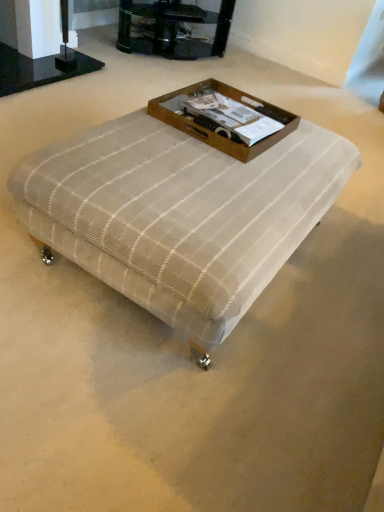
What do you see at coordinates (224, 118) in the screenshot? I see `brown wooden tray at center` at bounding box center [224, 118].

Describe the element at coordinates (180, 214) in the screenshot. I see `plaid fabric ottoman at center` at that location.

Where is `brown wooden tray at center`? The width and height of the screenshot is (384, 512). brown wooden tray at center is located at coordinates (224, 118).

From a real-world perspective, which object rests below the other?

plaid fabric ottoman at center, from a real-world perspective.

Could you tell me if plaid fabric ottoman at center is facing brown wooden tray at center?

No.

Is plaid fabric ottoman at center taller or shorter than brown wooden tray at center?

plaid fabric ottoman at center is taller than brown wooden tray at center.

Can we say plaid fabric ottoman at center lies outside brown wooden tray at center?

Yes.

From the image's perspective, which is above, clear glass tv stand at upper center or plaid fabric ottoman at center?

clear glass tv stand at upper center.

Is point (200, 57) positioned in front of point (155, 193)?

No, it is behind (155, 193).

Is clear glass tv stand at upper center aimed at plaid fabric ottoman at center?

Yes, clear glass tv stand at upper center is turned towards plaid fabric ottoman at center.

In the scene shown: Does clear glass tv stand at upper center have a lesser height compared to plaid fabric ottoman at center?

In fact, clear glass tv stand at upper center may be taller than plaid fabric ottoman at center.

Is plaid fabric ottoman at center looking in the opposite direction of clear glass tv stand at upper center?

No, plaid fabric ottoman at center is not facing the opposite direction of clear glass tv stand at upper center.

Is plaid fabric ottoman at center situated inside clear glass tv stand at upper center or outside?

plaid fabric ottoman at center lies outside clear glass tv stand at upper center.

From the picture: Between plaid fabric ottoman at center and clear glass tv stand at upper center, which one has more height?

With more height is clear glass tv stand at upper center.

Which object is more forward, plaid fabric ottoman at center or clear glass tv stand at upper center?

plaid fabric ottoman at center is in front.

Who is shorter, clear glass tv stand at upper center or brown wooden tray at center?

brown wooden tray at center is shorter.

Which is behind, point (200, 21) or point (157, 101)?

The point (200, 21) is more distant.

From the image's perspective, which object appears higher, clear glass tv stand at upper center or brown wooden tray at center?

clear glass tv stand at upper center appears higher in the image.

Is point (216, 106) closer to viewer compared to point (174, 40)?

Yes.

Do you think brown wooden tray at center is within clear glass tv stand at upper center, or outside of it?

brown wooden tray at center is spatially situated outside clear glass tv stand at upper center.

From a real-world perspective, which object stands above the other?

brown wooden tray at center is physically above.

Which is behind, brown wooden tray at center or clear glass tv stand at upper center?

Positioned behind is clear glass tv stand at upper center.

Can you tell me how much brown wooden tray at center and plaid fabric ottoman at center differ in facing direction?

The angular difference between brown wooden tray at center and plaid fabric ottoman at center is 1.64 degrees.

Is brown wooden tray at center surrounding plaid fabric ottoman at center?

No, plaid fabric ottoman at center is not a part of brown wooden tray at center.

At what (x,y) coordinates should I click in order to perform the action: click on table on the left of brown wooden tray at center. Please return your answer as a coordinate pair (x, y). Image resolution: width=384 pixels, height=512 pixels. Looking at the image, I should click on (180, 214).

In order to click on table that is in front of the brown wooden tray at center in this screenshot , I will do `click(180, 214)`.

This screenshot has height=512, width=384. I want to click on table below the clear glass tv stand at upper center (from a real-world perspective), so click(180, 214).

Looking at the image, which one is located closer to clear glass tv stand at upper center, brown wooden tray at center or plaid fabric ottoman at center?

Based on the image, brown wooden tray at center appears to be nearer to clear glass tv stand at upper center.

Based on their spatial positions, is plaid fabric ottoman at center or brown wooden tray at center closer to clear glass tv stand at upper center?

brown wooden tray at center is positioned closer to the anchor clear glass tv stand at upper center.

When comparing their distances from brown wooden tray at center, does plaid fabric ottoman at center or clear glass tv stand at upper center seem closer?

plaid fabric ottoman at center.

Looking at this image, considering their positions, is clear glass tv stand at upper center positioned closer to brown wooden tray at center than plaid fabric ottoman at center?

Among the two, plaid fabric ottoman at center is located nearer to brown wooden tray at center.

Which object lies nearer to the anchor point plaid fabric ottoman at center, brown wooden tray at center or clear glass tv stand at upper center?

The object closer to plaid fabric ottoman at center is brown wooden tray at center.

From the image, which object appears to be farther from plaid fabric ottoman at center, clear glass tv stand at upper center or brown wooden tray at center?

clear glass tv stand at upper center is further to plaid fabric ottoman at center.

What are the coordinates of `box between plaid fabric ottoman at center and clear glass tv stand at upper center from front to back` in the screenshot? It's located at (224, 118).